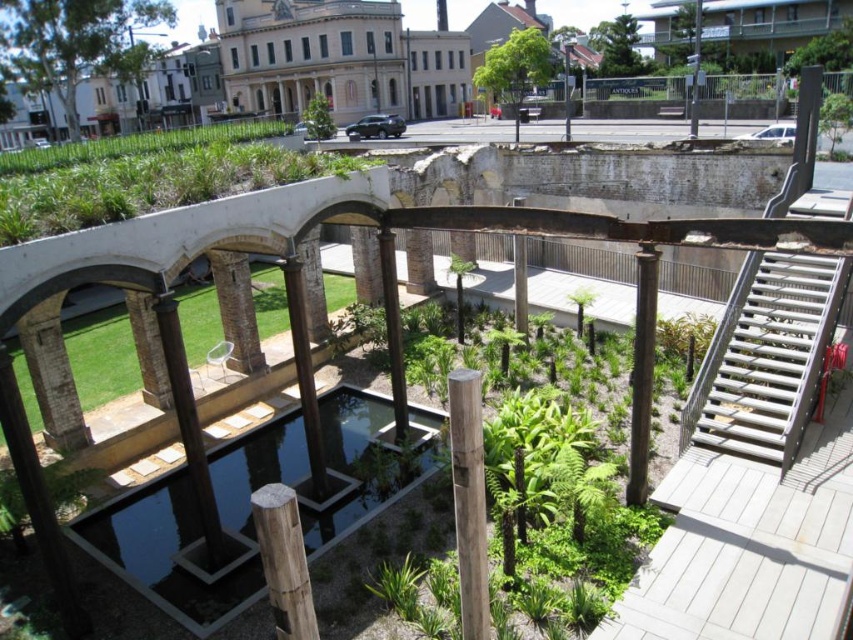
Describe the element at coordinates (764, 356) in the screenshot. I see `metallic silver stairs at right` at that location.

Can you confirm if metallic silver stairs at right is positioned above green grass at upper center?

No.

Who is more distant from viewer, (839, 282) or (102, 160)?

Point (102, 160)

Find the location of a particular element. This screenshot has height=640, width=853. metallic silver stairs at right is located at coordinates (764, 356).

Where is `metallic silver stairs at right`? The height and width of the screenshot is (640, 853). metallic silver stairs at right is located at coordinates (764, 356).

Describe the element at coordinates (764, 356) in the screenshot. I see `metallic silver stairs at right` at that location.

Does point (767, 324) come in front of point (305, 131)?

Yes, point (767, 324) is in front of point (305, 131).

Find the location of a particular element. Image resolution: width=853 pixels, height=640 pixels. metallic silver stairs at right is located at coordinates (764, 356).

Does brown wood post at center have a larger size compared to wooden post at center?

Yes, brown wood post at center is bigger than wooden post at center.

Does brown wood post at center have a smaller size compared to wooden post at center?

Incorrect, brown wood post at center is not smaller in size than wooden post at center.

Between point (451, 412) and point (289, 509), which one is positioned behind?

Point (451, 412)

Image resolution: width=853 pixels, height=640 pixels. In order to click on brown wood post at center in this screenshot , I will do `click(468, 499)`.